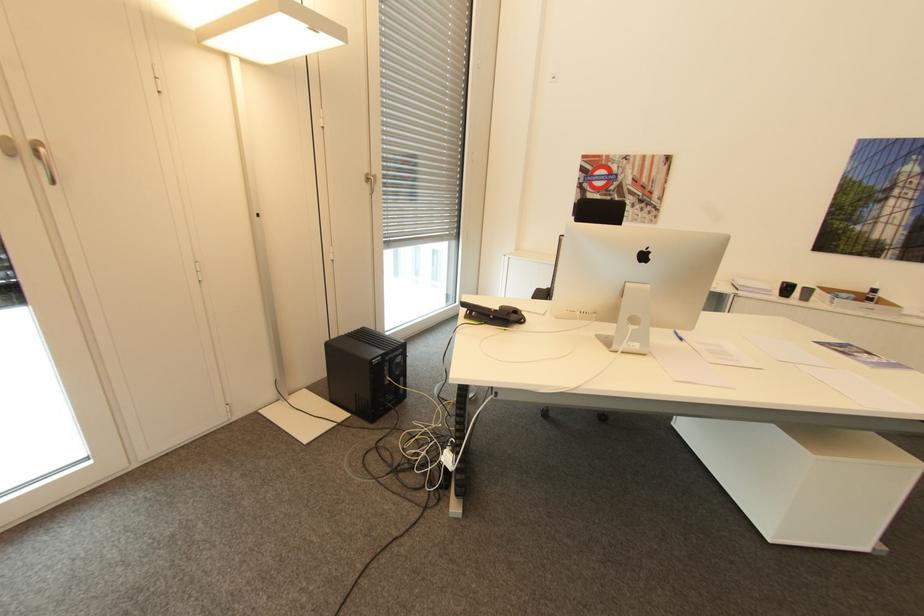
You are a GUI agent. You are given a task and a screenshot of the screen. Output one action in this format:
    pyautogui.click(x=<x>, y=<y>)
    Task: Click on the blue ballpoint pen
    This screenshot has height=616, width=924.
    Given the screenshot: What is the action you would take?
    pyautogui.click(x=677, y=334)